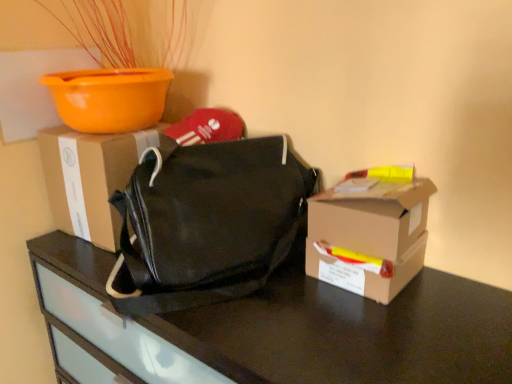
I want to click on vacant space that's between black canvas bag at center and brown cardboard box at right, the 1th box in the right-to-left sequence, so click(284, 310).